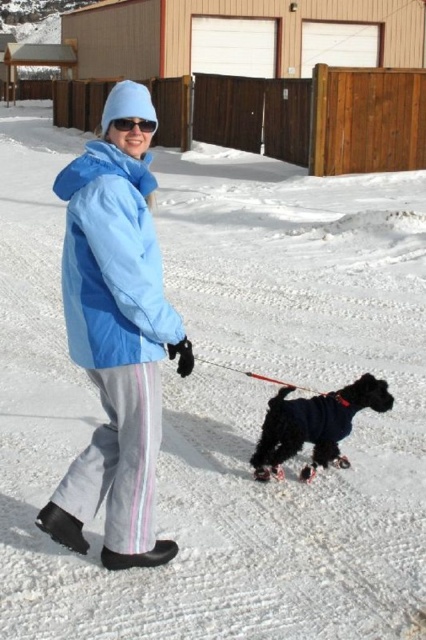
Question: Which of the following is the closest to the observer?

Choices:
 (A) blue matte jacket at center
 (B) blue reflective sunglasses at upper center
 (C) shiny black coat at lower center
 (D) blue fabric jacket at center

Answer: (A)

Question: Is blue fabric jacket at center above blue matte jacket at center?

Choices:
 (A) yes
 (B) no

Answer: (B)

Question: Does blue matte jacket at center have a lesser width compared to blue reflective sunglasses at upper center?

Choices:
 (A) no
 (B) yes

Answer: (A)

Question: Which of these objects is positioned farthest from the blue matte jacket at center?

Choices:
 (A) blue fabric jacket at center
 (B) blue reflective sunglasses at upper center

Answer: (B)

Question: Which point is closer to the camera?

Choices:
 (A) blue fabric jacket at center
 (B) shiny black coat at lower center
 (C) blue matte jacket at center

Answer: (C)

Question: Does blue matte jacket at center have a smaller size compared to shiny black coat at lower center?

Choices:
 (A) yes
 (B) no

Answer: (B)